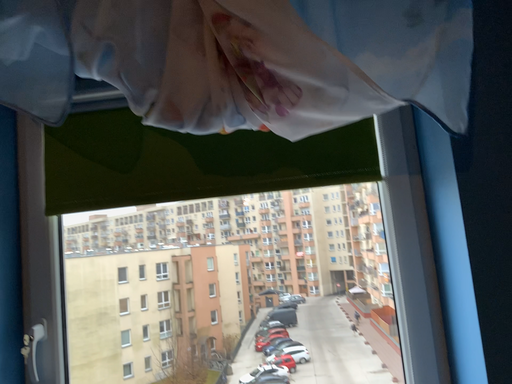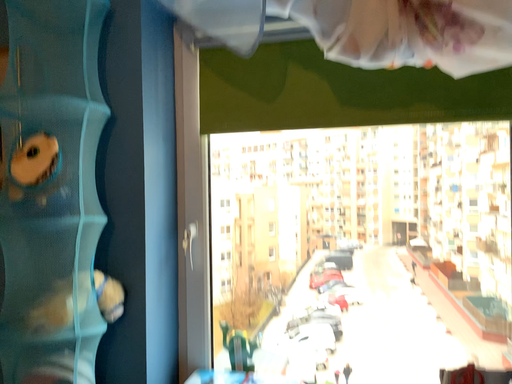
Question: How did the camera likely rotate when shooting the video?

Choices:
 (A) rotated left
 (B) rotated right

Answer: (A)